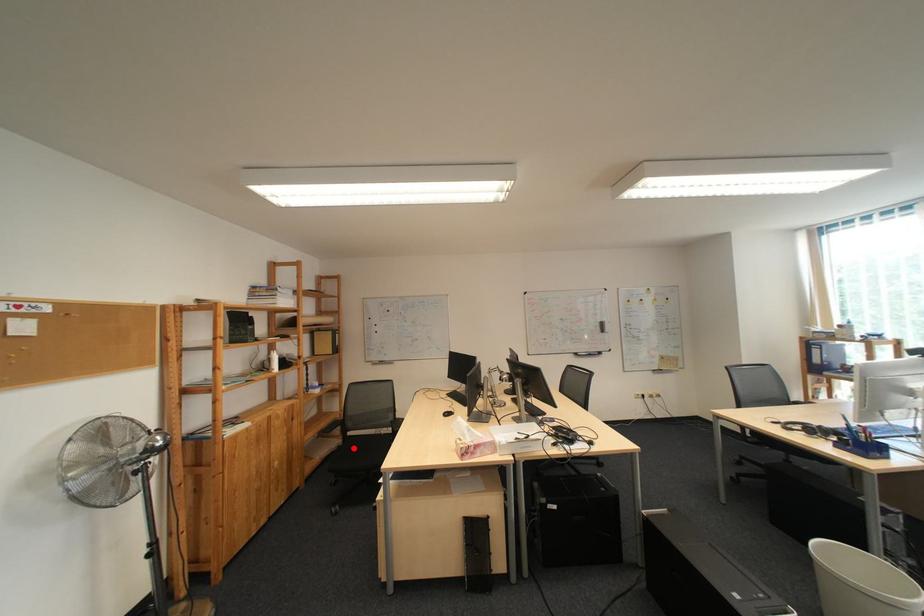
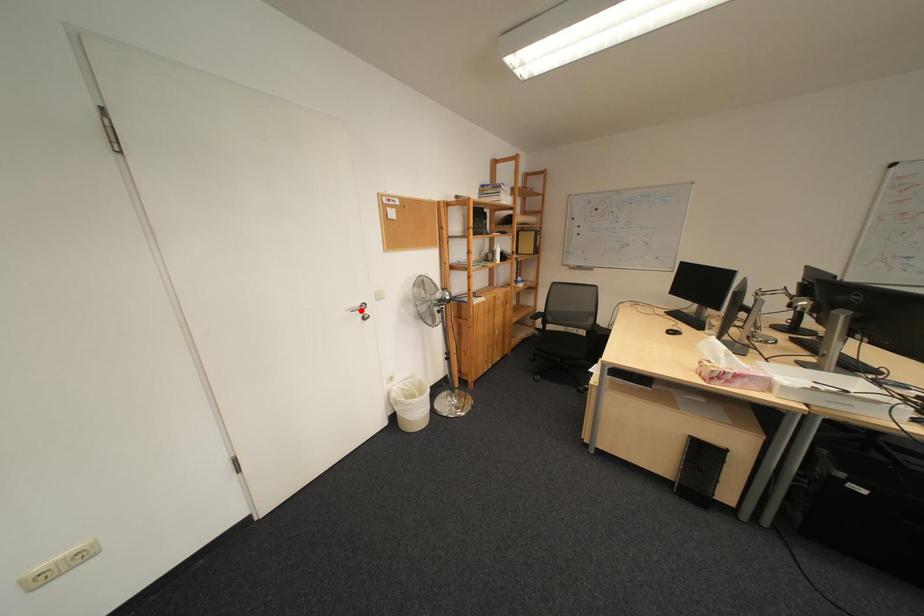
I am providing you with two images of the same scene from different viewpoints. A red point is marked on the first image and another point is marked on the second image. Is the red point in image1 aligned with the point shown in image2?

No